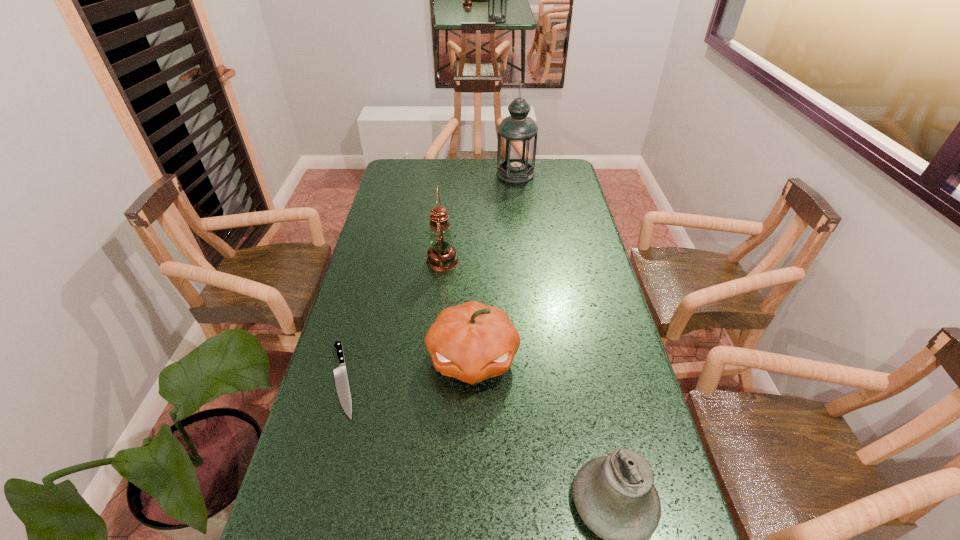
You are a GUI agent. You are given a task and a screenshot of the screen. Output one action in this format:
    pyautogui.click(x=<x>, y=<y>)
    Task: Click on the free space located 0.110m on the right of the steak knife
    
    Given the screenshot: What is the action you would take?
    pos(402,380)

Where is `object at the far edge`? The image size is (960, 540). object at the far edge is located at coordinates (517, 134).

This screenshot has width=960, height=540. In order to click on object at the left edge in this screenshot , I will do coord(340,374).

This screenshot has height=540, width=960. In the image, there is a desktop. Identify the location of vacant area at the far edge. (537, 173).

In the image, there is a desktop. At what (x,y) coordinates should I click in order to perform the action: click on vacant space at the left edge. Please return your answer as a coordinate pair (x, y). Image resolution: width=960 pixels, height=540 pixels. Looking at the image, I should click on (400, 186).

In the image, there is a desktop. At what (x,y) coordinates should I click in order to perform the action: click on vacant space at the right edge. Please return your answer as a coordinate pair (x, y). Looking at the image, I should click on (554, 220).

In the image, there is a desktop. Identify the location of vacant space at the far left corner. (406, 180).

The width and height of the screenshot is (960, 540). In order to click on free space between the steak knife and the fourth nearest object in this screenshot , I will do `click(393, 320)`.

Where is `vacant region between the taller oil lamp and the leftmost object`? The height and width of the screenshot is (540, 960). vacant region between the taller oil lamp and the leftmost object is located at coordinates (429, 277).

The image size is (960, 540). What are the coordinates of `unoccupied area between the farthest object and the shorter oil lamp` in the screenshot? It's located at (479, 218).